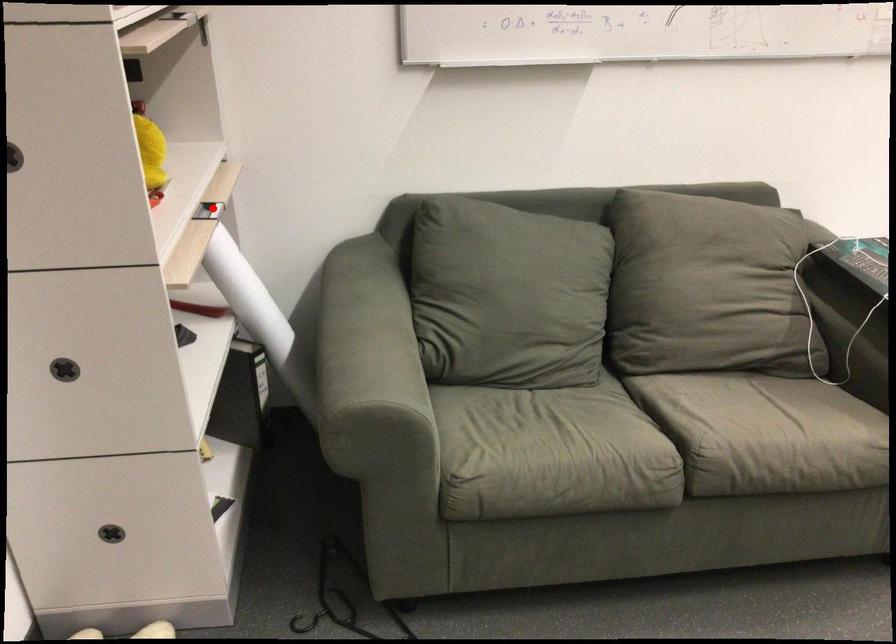
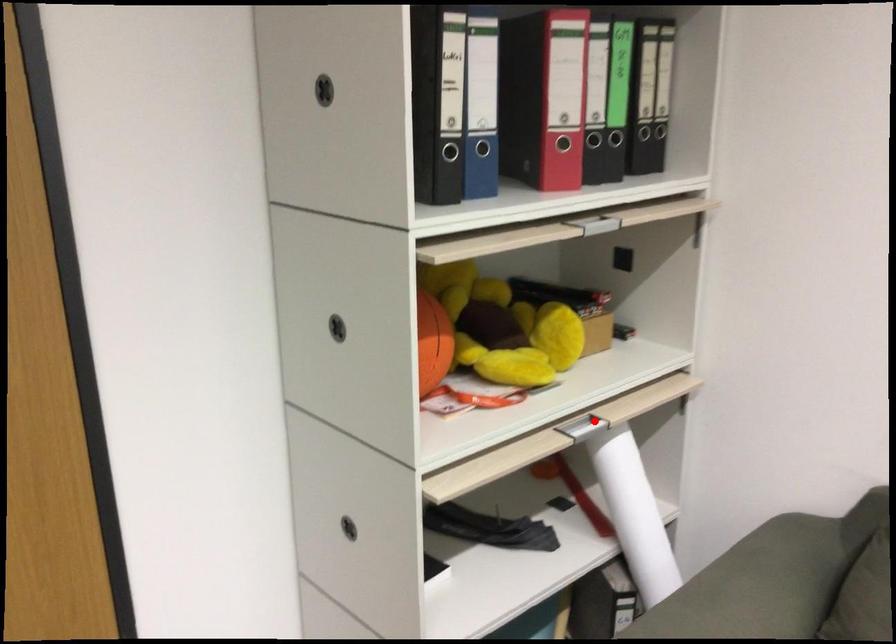
I am providing you with two images of the same scene from different viewpoints. A red point is marked on the first image and another point is marked on the second image. Do the highlighted points in image1 and image2 indicate the same real-world spot?

Yes